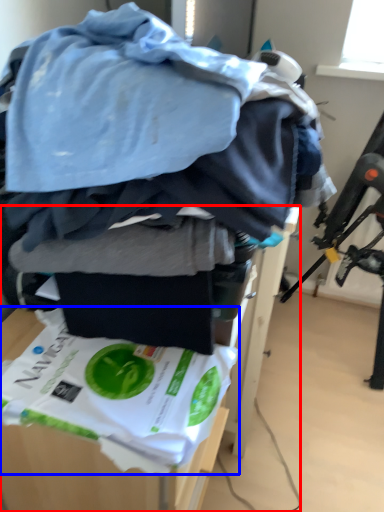
Question: Which point is closer to the camera, furniture (highlighted by a red box) or waste (highlighted by a blue box)?

Choices:
 (A) furniture
 (B) waste

Answer: (B)